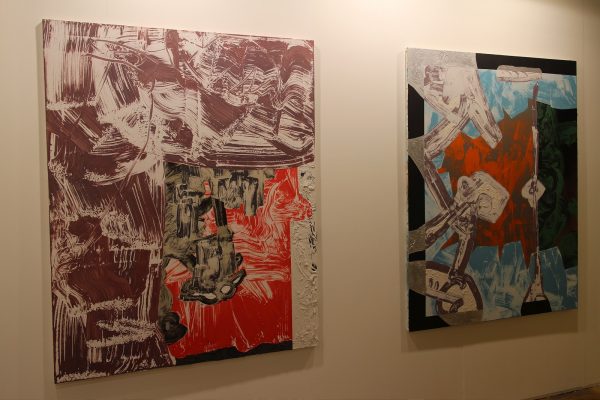
The image size is (600, 400). In order to click on off-white/beige colored wall in this screenshot , I will do `click(356, 242)`.